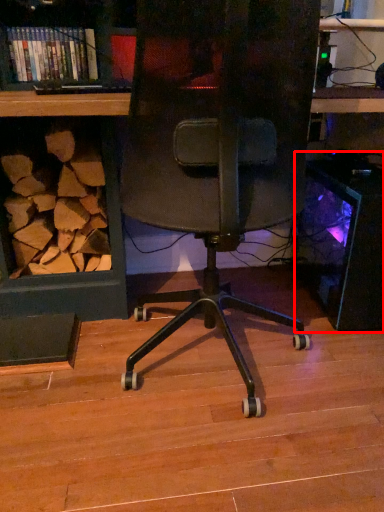
Question: From the image's perspective, where is desktop computer (annotated by the red box) located in relation to book in the image?

Choices:
 (A) above
 (B) below

Answer: (B)